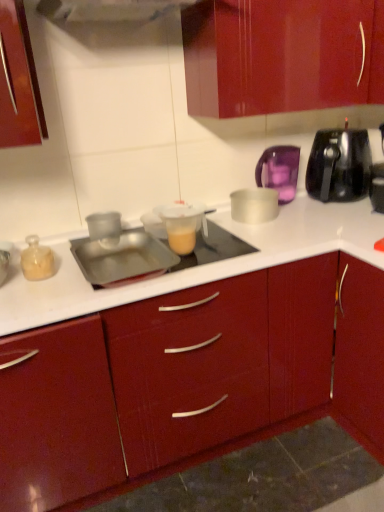
Consider the image. In order to face transparent plastic cup at center, acting as the 2th kitchen appliance starting from the left, should I rotate leftwards or rightwards?

Turn left approximately 11.281 degrees to face it.

You are a GUI agent. You are given a task and a screenshot of the screen. Output one action in this format:
    pyautogui.click(x=<x>, y=<y>)
    Task: Click on the transparent plastic cup at center, the fourth kitchen appliance viewed from the right
    The image size is (384, 512).
    Given the screenshot: What is the action you would take?
    point(105,228)

Locate an element on the screen. translucent glass jar at left, which is the 1th kitchen appliance from left to right is located at coordinates (37, 260).

The height and width of the screenshot is (512, 384). I want to click on glossy wood cabinet at center, so click(x=189, y=379).

Which is further, [282,163] or [325,130]?

The point [325,130] is farther from the camera.

Is purple translucent kettle at upper right, the second kitchen appliance in the right-to-left sequence, positioned with its back to black plastic toaster at upper right, the 1th kitchen appliance positioned from the right?

No, purple translucent kettle at upper right, the second kitchen appliance in the right-to-left sequence,'s orientation is not away from black plastic toaster at upper right, the 1th kitchen appliance positioned from the right.

Considering the positions of objects purple translucent kettle at upper right, the 4th kitchen appliance when ordered from left to right, and black plastic toaster at upper right, the 1th kitchen appliance positioned from the right, in the image provided, who is more to the left, purple translucent kettle at upper right, the 4th kitchen appliance when ordered from left to right, or black plastic toaster at upper right, the 1th kitchen appliance positioned from the right,?

purple translucent kettle at upper right, the 4th kitchen appliance when ordered from left to right, is more to the left.

Is translucent glass jar at left, the 5th kitchen appliance positioned from the right, next to black plastic toaster at upper right, the 1th kitchen appliance positioned from the right, and touching it?

translucent glass jar at left, the 5th kitchen appliance positioned from the right, and black plastic toaster at upper right, the 1th kitchen appliance positioned from the right, are not in contact.

Is translucent glass jar at left, the 5th kitchen appliance positioned from the right, taller or shorter than black plastic toaster at upper right, the 1th kitchen appliance positioned from the right?

Clearly, translucent glass jar at left, the 5th kitchen appliance positioned from the right, is shorter compared to black plastic toaster at upper right, the 1th kitchen appliance positioned from the right.

From the image's perspective, is translucent glass jar at left, which is the 1th kitchen appliance from left to right, positioned above or below black plastic toaster at upper right, the 1th kitchen appliance positioned from the right?

Clearly, from the image's perspective, translucent glass jar at left, which is the 1th kitchen appliance from left to right, is below black plastic toaster at upper right, the 1th kitchen appliance positioned from the right.

Considering the sizes of objects translucent glass jar at left, which is the 1th kitchen appliance from left to right, and black plastic toaster at upper right, the 1th kitchen appliance positioned from the right, in the image provided, who is smaller, translucent glass jar at left, which is the 1th kitchen appliance from left to right, or black plastic toaster at upper right, the 1th kitchen appliance positioned from the right,?

translucent glass jar at left, which is the 1th kitchen appliance from left to right.

Considering the relative positions of silver metallic bowl at center, which appears as the 3th kitchen appliance when viewed from the right, and glossy wood cabinet at center in the image provided, is silver metallic bowl at center, which appears as the 3th kitchen appliance when viewed from the right, to the left or to the right of glossy wood cabinet at center?

silver metallic bowl at center, which appears as the 3th kitchen appliance when viewed from the right, is positioned on glossy wood cabinet at center's right side.

Is the depth of silver metallic bowl at center, positioned as the 3th kitchen appliance in left-to-right order, greater than that of glossy wood cabinet at center?

Yes, silver metallic bowl at center, positioned as the 3th kitchen appliance in left-to-right order, is behind glossy wood cabinet at center.

Based on the photo, is silver metallic bowl at center, which appears as the 3th kitchen appliance when viewed from the right, not near glossy wood cabinet at center?

Result: No, silver metallic bowl at center, which appears as the 3th kitchen appliance when viewed from the right, is not far from glossy wood cabinet at center.

In the scene shown: Does silver metallic bowl at center, positioned as the 3th kitchen appliance in left-to-right order, have a greater width compared to glossy wood cabinet at center?

No, silver metallic bowl at center, positioned as the 3th kitchen appliance in left-to-right order, is not wider than glossy wood cabinet at center.

Considering the sizes of objects silver metallic bowl at center, positioned as the 3th kitchen appliance in left-to-right order, and purple translucent kettle at upper right, the second kitchen appliance in the right-to-left sequence, in the image provided, who is bigger, silver metallic bowl at center, positioned as the 3th kitchen appliance in left-to-right order, or purple translucent kettle at upper right, the second kitchen appliance in the right-to-left sequence,?

With larger size is purple translucent kettle at upper right, the second kitchen appliance in the right-to-left sequence.

From a real-world perspective, relative to purple translucent kettle at upper right, the 4th kitchen appliance when ordered from left to right, is silver metallic bowl at center, positioned as the 3th kitchen appliance in left-to-right order, vertically above or below?

In terms of real-world spatial position, silver metallic bowl at center, positioned as the 3th kitchen appliance in left-to-right order, is below purple translucent kettle at upper right, the 4th kitchen appliance when ordered from left to right.

Can you tell me how much silver metallic bowl at center, positioned as the 3th kitchen appliance in left-to-right order, and purple translucent kettle at upper right, the 4th kitchen appliance when ordered from left to right, differ in facing direction?

The facing directions of silver metallic bowl at center, positioned as the 3th kitchen appliance in left-to-right order, and purple translucent kettle at upper right, the 4th kitchen appliance when ordered from left to right, are 7.51 degrees apart.

From the image's perspective, between silver metallic bowl at center, which appears as the 3th kitchen appliance when viewed from the right, and purple translucent kettle at upper right, the 4th kitchen appliance when ordered from left to right, who is located below?

silver metallic bowl at center, which appears as the 3th kitchen appliance when viewed from the right, appears lower in the image.

Locate an element on the screen. This screenshot has width=384, height=512. cabinetry below the translucent plastic measuring cup at center, placed as the first appliance when sorted from right to left (from a real-world perspective) is located at coordinates (189, 379).

From a real-world perspective, which is physically below, glossy wood cabinet at center or translucent plastic measuring cup at center, placed as the first appliance when sorted from right to left?

glossy wood cabinet at center is physically lower.

Between glossy wood cabinet at center and translucent plastic measuring cup at center, which appears as the 2th appliance when viewed from the left, which one has larger width?

Wider between the two is glossy wood cabinet at center.

Is point (206, 421) positioned before point (181, 253)?

No, it is behind (181, 253).

Based on the photo, what's the angular difference between silver metallic bowl at center, positioned as the 3th kitchen appliance in left-to-right order, and transparent plastic cup at center, acting as the 2th kitchen appliance starting from the left,'s facing directions?

1.22 degrees.

How distant is silver metallic bowl at center, which appears as the 3th kitchen appliance when viewed from the right, from transparent plastic cup at center, acting as the 2th kitchen appliance starting from the left?

silver metallic bowl at center, which appears as the 3th kitchen appliance when viewed from the right, is 21.23 inches away from transparent plastic cup at center, acting as the 2th kitchen appliance starting from the left.

Considering the positions of objects silver metallic bowl at center, which appears as the 3th kitchen appliance when viewed from the right, and transparent plastic cup at center, the fourth kitchen appliance viewed from the right, in the image provided, who is in front, silver metallic bowl at center, which appears as the 3th kitchen appliance when viewed from the right, or transparent plastic cup at center, the fourth kitchen appliance viewed from the right,?

Positioned in front is transparent plastic cup at center, the fourth kitchen appliance viewed from the right.

From the image's perspective, relative to transparent plastic cup at center, acting as the 2th kitchen appliance starting from the left, is silver metallic bowl at center, positioned as the 3th kitchen appliance in left-to-right order, above or below?

silver metallic bowl at center, positioned as the 3th kitchen appliance in left-to-right order, is situated higher than transparent plastic cup at center, acting as the 2th kitchen appliance starting from the left, in the image.

What are the coordinates of `cabinetry in front of the translucent glass jar at left, which is the 1th kitchen appliance from left to right` in the screenshot? It's located at (189, 379).

Which point is more forward, (228, 349) or (32, 274)?

The point (32, 274) is closer to the camera.

Would you say glossy wood cabinet at center is a long distance from translucent glass jar at left, the 5th kitchen appliance positioned from the right?

No, there isn't a large distance between glossy wood cabinet at center and translucent glass jar at left, the 5th kitchen appliance positioned from the right.

In the scene shown: Which object is positioned more to the right, glossy wood cabinet at center or translucent glass jar at left, which is the 1th kitchen appliance from left to right?

From the viewer's perspective, glossy wood cabinet at center appears more on the right side.

Starting from the purple translucent kettle at upper right, the 4th kitchen appliance when ordered from left to right, which kitchen appliance is the 1st one in front? Please provide its 2D coordinates.

[(339, 165)]

This screenshot has height=512, width=384. There is a black plastic toaster at upper right, positioned as the 5th kitchen appliance in left-to-right order. What are the coordinates of `the 4th kitchen appliance below it (from the image's perspective)` in the screenshot? It's located at (37, 260).

In the scene shown: Based on their spatial positions, is glossy wood cabinet at center or silver metallic bowl at center, which appears as the 3th kitchen appliance when viewed from the right, closer to metallic silver tray at center, arranged as the 2th appliance when viewed from the right?

Based on the image, glossy wood cabinet at center appears to be nearer to metallic silver tray at center, arranged as the 2th appliance when viewed from the right.

Based on their spatial positions, is metallic silver tray at center, marked as the 1th appliance in a left-to-right arrangement, or translucent glass jar at left, which is the 1th kitchen appliance from left to right, further from black plastic toaster at upper right, the 1th kitchen appliance positioned from the right?

Among the two, translucent glass jar at left, which is the 1th kitchen appliance from left to right, is located further to black plastic toaster at upper right, the 1th kitchen appliance positioned from the right.

When comparing their distances from silver metallic bowl at center, positioned as the 3th kitchen appliance in left-to-right order, does metallic silver tray at center, arranged as the 2th appliance when viewed from the right, or purple translucent kettle at upper right, the 4th kitchen appliance when ordered from left to right, seem further?

Based on the image, metallic silver tray at center, arranged as the 2th appliance when viewed from the right, appears to be further to silver metallic bowl at center, positioned as the 3th kitchen appliance in left-to-right order.

Estimate the real-world distances between objects in this image. Which object is closer to purple translucent kettle at upper right, the second kitchen appliance in the right-to-left sequence, transparent plastic cup at center, the fourth kitchen appliance viewed from the right, or black plastic toaster at upper right, positioned as the 5th kitchen appliance in left-to-right order?

black plastic toaster at upper right, positioned as the 5th kitchen appliance in left-to-right order.

When comparing their distances from transparent plastic cup at center, acting as the 2th kitchen appliance starting from the left, does silver metallic bowl at center, which appears as the 3th kitchen appliance when viewed from the right, or translucent plastic measuring cup at center, placed as the first appliance when sorted from right to left, seem further?

silver metallic bowl at center, which appears as the 3th kitchen appliance when viewed from the right.

Looking at the image, which one is located further to transparent plastic cup at center, the fourth kitchen appliance viewed from the right, purple translucent kettle at upper right, the second kitchen appliance in the right-to-left sequence, or metallic silver tray at center, arranged as the 2th appliance when viewed from the right?

purple translucent kettle at upper right, the second kitchen appliance in the right-to-left sequence, is positioned further to the anchor transparent plastic cup at center, the fourth kitchen appliance viewed from the right.

Looking at the image, which one is located further to purple translucent kettle at upper right, the 4th kitchen appliance when ordered from left to right, silver metallic bowl at center, positioned as the 3th kitchen appliance in left-to-right order, or metallic silver tray at center, marked as the 1th appliance in a left-to-right arrangement?

metallic silver tray at center, marked as the 1th appliance in a left-to-right arrangement, lies further to purple translucent kettle at upper right, the 4th kitchen appliance when ordered from left to right, than the other object.

When comparing their distances from translucent glass jar at left, the 5th kitchen appliance positioned from the right, does metallic silver tray at center, arranged as the 2th appliance when viewed from the right, or purple translucent kettle at upper right, the second kitchen appliance in the right-to-left sequence, seem further?

purple translucent kettle at upper right, the second kitchen appliance in the right-to-left sequence, is further to translucent glass jar at left, the 5th kitchen appliance positioned from the right.

At what (x,y) coordinates should I click in order to perform the action: click on kitchen appliance located between translucent plastic measuring cup at center, which appears as the 2th appliance when viewed from the left, and purple translucent kettle at upper right, the second kitchen appliance in the right-to-left sequence, in the left-right direction. Please return your answer as a coordinate pair (x, y). Image resolution: width=384 pixels, height=512 pixels. Looking at the image, I should click on (254, 205).

The image size is (384, 512). I want to click on kitchen appliance between metallic silver tray at center, marked as the 1th appliance in a left-to-right arrangement, and purple translucent kettle at upper right, the 4th kitchen appliance when ordered from left to right, so click(254, 205).

Where is `kitchen appliance between silver metallic bowl at center, positioned as the 3th kitchen appliance in left-to-right order, and black plastic toaster at upper right, positioned as the 5th kitchen appliance in left-to-right order, in the horizontal direction`? Image resolution: width=384 pixels, height=512 pixels. kitchen appliance between silver metallic bowl at center, positioned as the 3th kitchen appliance in left-to-right order, and black plastic toaster at upper right, positioned as the 5th kitchen appliance in left-to-right order, in the horizontal direction is located at coordinates (279, 170).

This screenshot has width=384, height=512. I want to click on appliance between glossy wood cabinet at center and translucent glass jar at left, the 5th kitchen appliance positioned from the right, from front to back, so click(123, 259).